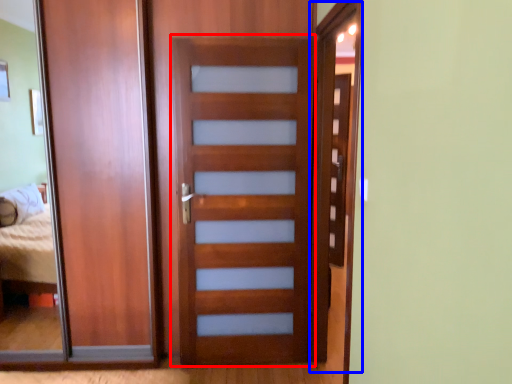
Question: Which object is closer to the camera taking this photo, screen door (highlighted by a red box) or screen door (highlighted by a blue box)?

Choices:
 (A) screen door
 (B) screen door

Answer: (B)